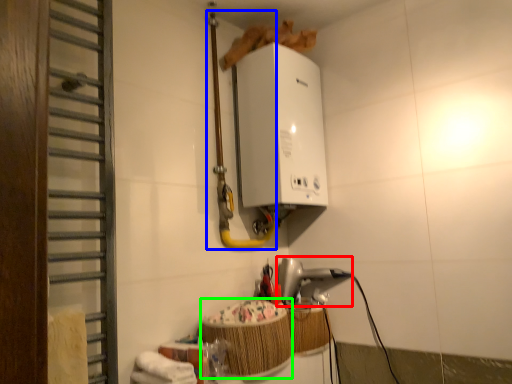
Question: Estimate the real-world distances between objects in this image. Which object is closer to appliance (highlighted by a red box), pipe (highlighted by a blue box) or basket (highlighted by a green box)?

Choices:
 (A) pipe
 (B) basket

Answer: (B)